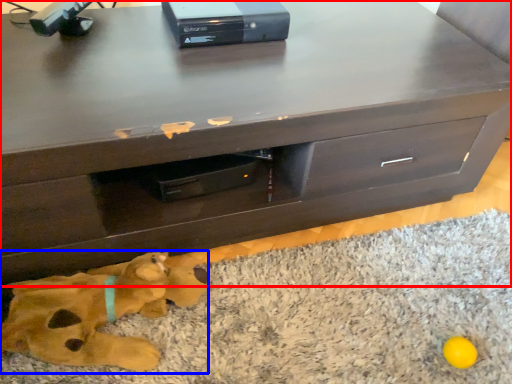
Question: Which point is further to the camera, chest of drawers (highlighted by a red box) or animal (highlighted by a blue box)?

Choices:
 (A) chest of drawers
 (B) animal

Answer: (B)